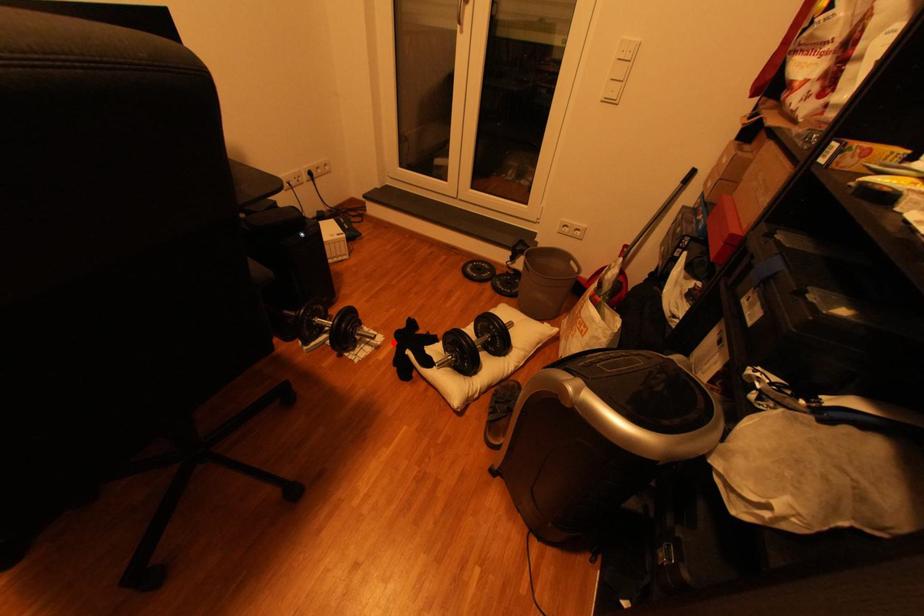
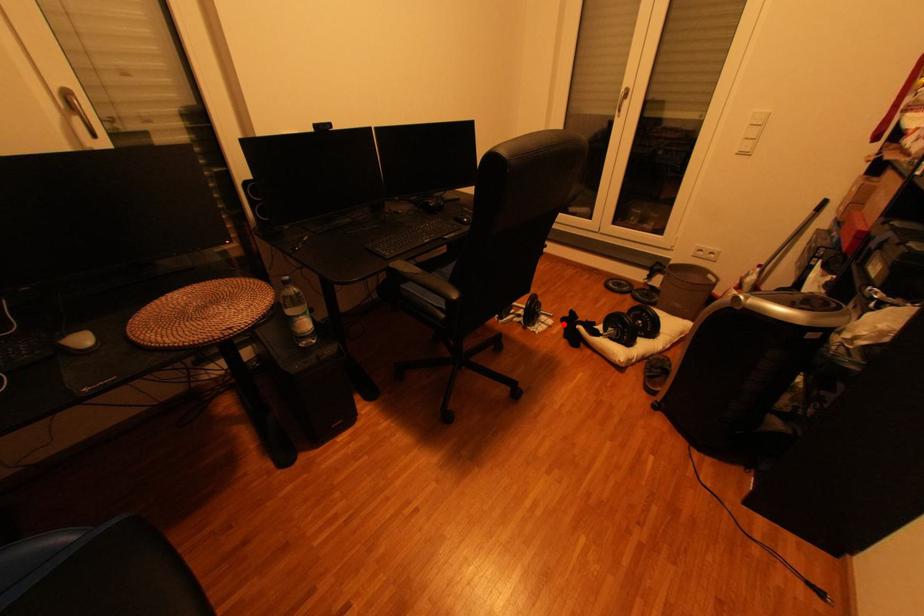
I am providing you with two images of the same scene from different viewpoints. A red point is marked on the first image and another point is marked on the second image. Are the points marked in image1 and image2 representing the same 3D position?

Yes